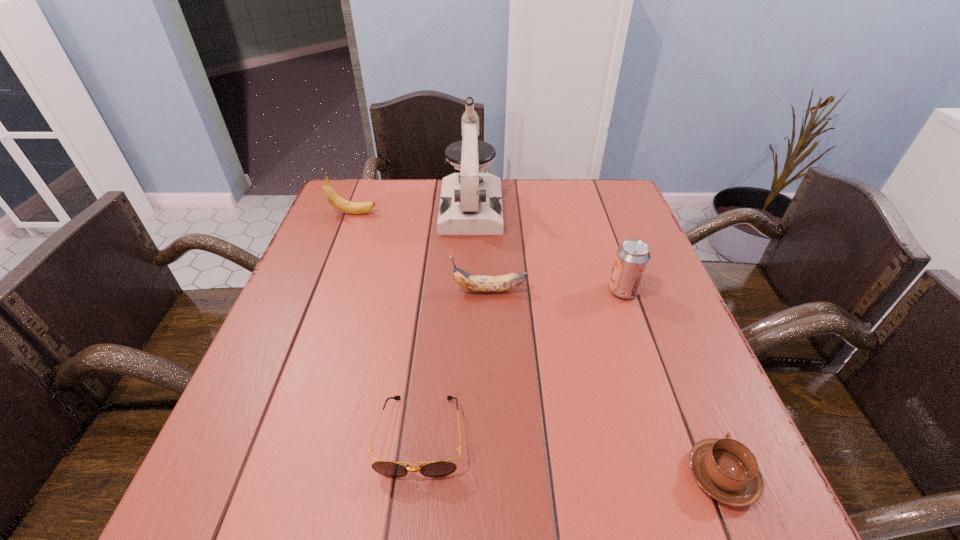
Identify the location of sunglasses positioned at the near edge. (434, 469).

The width and height of the screenshot is (960, 540). Identify the location of object that is at the left edge. (331, 196).

Find the location of `beer can at the right edge`. beer can at the right edge is located at coordinates (632, 258).

What are the coordinates of `cappuccino that is at the right edge` in the screenshot? It's located at (727, 470).

At what (x,y) coordinates should I click in order to perform the action: click on object present at the far left corner. Please return your answer as a coordinate pair (x, y). This screenshot has height=540, width=960. Looking at the image, I should click on (331, 196).

Find the location of a particular element. This screenshot has width=960, height=540. object that is at the near right corner is located at coordinates (727, 470).

The width and height of the screenshot is (960, 540). I want to click on free spot at the far edge of the desktop, so click(532, 212).

At what (x,y) coordinates should I click in order to perform the action: click on vacant space at the near edge of the desktop. Please return your answer as a coordinate pair (x, y). Image resolution: width=960 pixels, height=540 pixels. Looking at the image, I should click on (502, 471).

The width and height of the screenshot is (960, 540). Find the location of `free spot at the left edge of the desktop`. free spot at the left edge of the desktop is located at coordinates (336, 369).

Identify the location of vacant space at the right edge of the desktop. Image resolution: width=960 pixels, height=540 pixels. (662, 351).